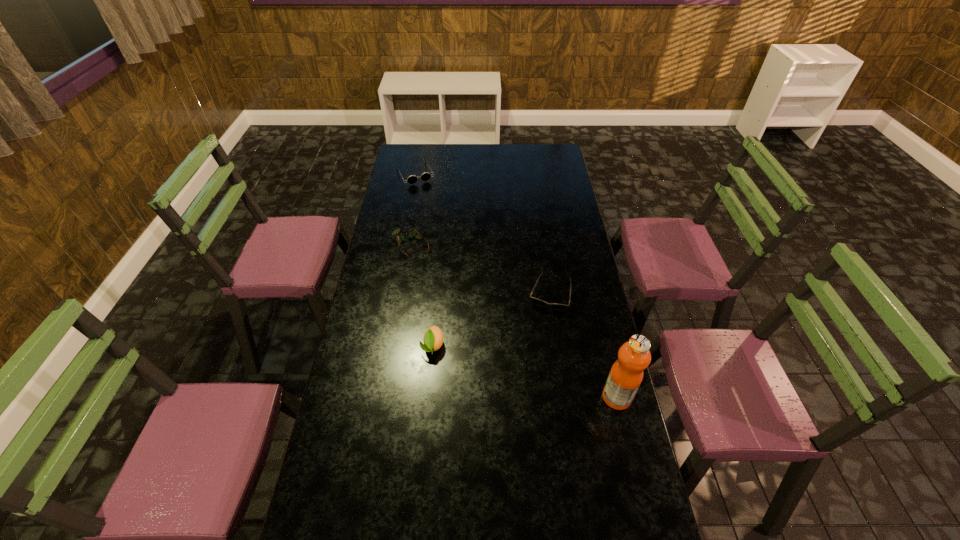
Locate an element on the screen. The height and width of the screenshot is (540, 960). object that is at the far edge is located at coordinates (425, 176).

I want to click on spectacles at the left edge, so click(x=412, y=233).

The width and height of the screenshot is (960, 540). Identify the location of sunglasses positioned at the left edge. (425, 176).

Identify the location of fruit juice that is positioned at the right edge. (626, 374).

The image size is (960, 540). In order to click on sunglasses positioned at the right edge in this screenshot , I will do `click(556, 306)`.

Identify the location of object positioned at the far left corner. (425, 176).

In the image, there is a desktop. Identify the location of vacant space at the far edge. The height and width of the screenshot is (540, 960). (525, 150).

The width and height of the screenshot is (960, 540). In order to click on vacant area at the near edge of the desktop in this screenshot , I will do `click(460, 523)`.

In the image, there is a desktop. At what (x,y) coordinates should I click in order to perform the action: click on vacant space at the left edge. Please return your answer as a coordinate pair (x, y). The image size is (960, 540). Looking at the image, I should click on 364,408.

Image resolution: width=960 pixels, height=540 pixels. Identify the location of blank area at the right edge. (569, 286).